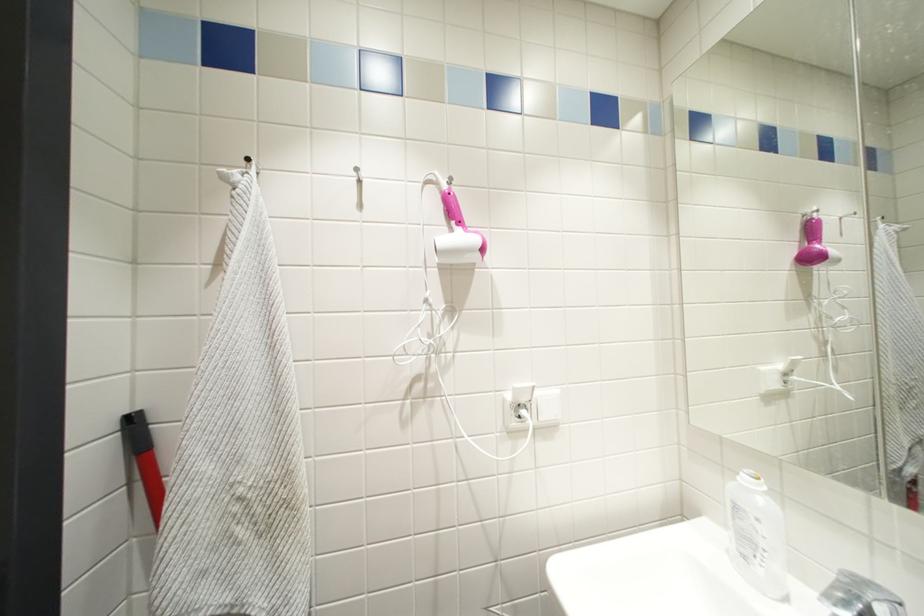
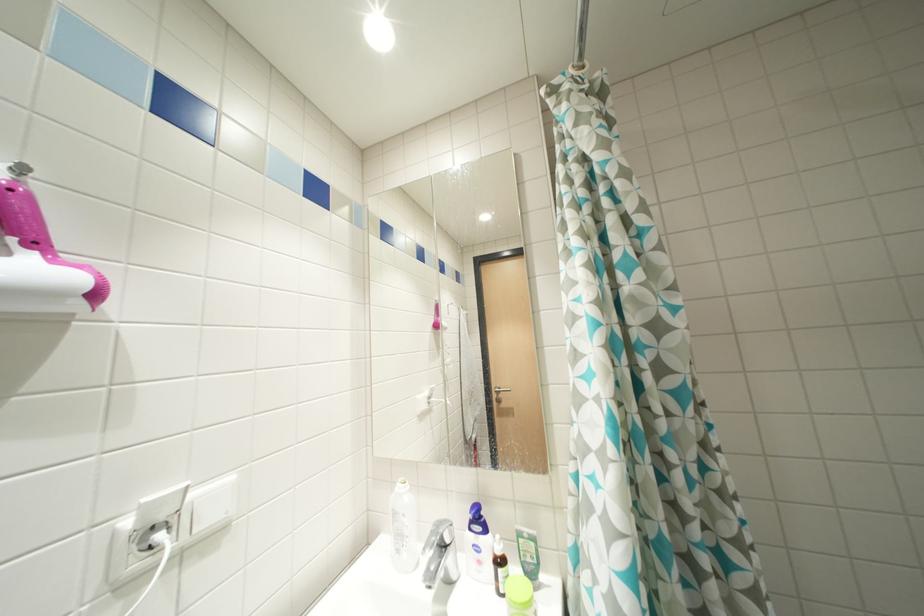
Question: Based on the continuous images, in which direction is the camera rotating? Reply with the corresponding letter.

Choices:
 (A) Left
 (B) Right
 (C) Up
 (D) Down

Answer: (B)